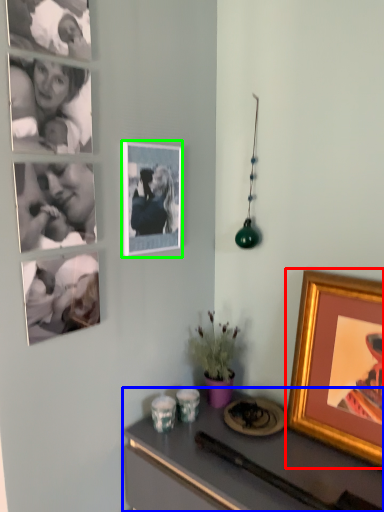
Question: Considering the real-world distances, which object is farthest from picture frame (highlighted by a red box)? desk (highlighted by a blue box) or picture frame (highlighted by a green box)?

Choices:
 (A) desk
 (B) picture frame

Answer: (B)